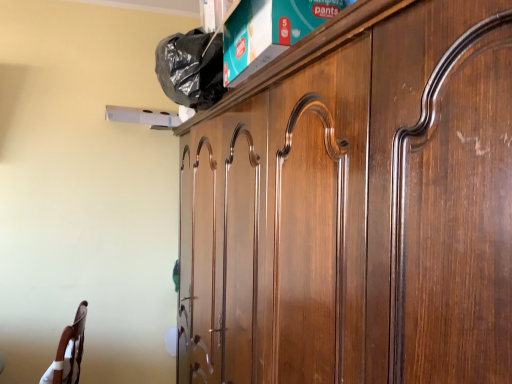
Where is `dark wood cupboard at upper center`? Image resolution: width=512 pixels, height=384 pixels. dark wood cupboard at upper center is located at coordinates click(x=355, y=206).

Describe the element at coordinates (355, 206) in the screenshot. I see `dark wood cupboard at upper center` at that location.

In order to face dark wood cupboard at upper center, should I rotate leftwards or rightwards?

A 5.613 degree turn to the right will do.

This screenshot has height=384, width=512. Find the location of `dark wood cupboard at upper center`. dark wood cupboard at upper center is located at coordinates (355, 206).